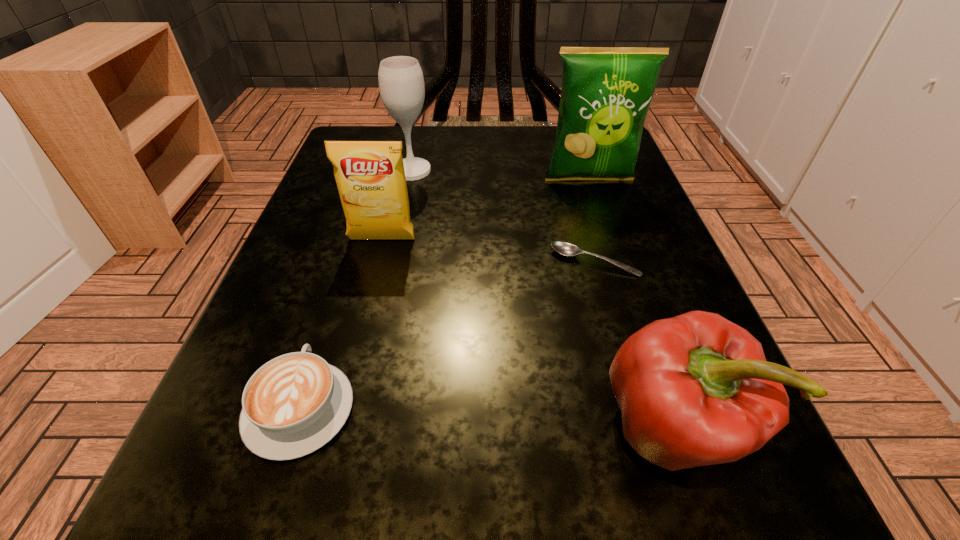
Identify the location of the taller crisp (potato chip). This screenshot has width=960, height=540. (606, 92).

At what (x,y) coordinates should I click in order to perform the action: click on the right crisp (potato chip). Please return your answer as a coordinate pair (x, y). Image resolution: width=960 pixels, height=540 pixels. Looking at the image, I should click on (606, 92).

Image resolution: width=960 pixels, height=540 pixels. Find the location of `the second tallest object`. the second tallest object is located at coordinates (401, 83).

At what (x,y) coordinates should I click in order to perform the action: click on the shorter crisp (potato chip). Please return your answer as a coordinate pair (x, y). This screenshot has width=960, height=540. Looking at the image, I should click on (370, 176).

Find the location of a particular element. the nearer crisp (potato chip) is located at coordinates (370, 176).

Locate an element on the screen. This screenshot has height=540, width=960. bell pepper is located at coordinates (694, 390).

Locate an element on the screen. The image size is (960, 540). cappuccino is located at coordinates (294, 404).

Identify the location of the shortest object. This screenshot has height=540, width=960. (564, 248).

Where is `free space located on the front-facing side of the taller crisp (potato chip)`? This screenshot has height=540, width=960. free space located on the front-facing side of the taller crisp (potato chip) is located at coordinates (608, 234).

Identify the location of vacant region located on the front of the wineglass. Image resolution: width=960 pixels, height=540 pixels. (396, 244).